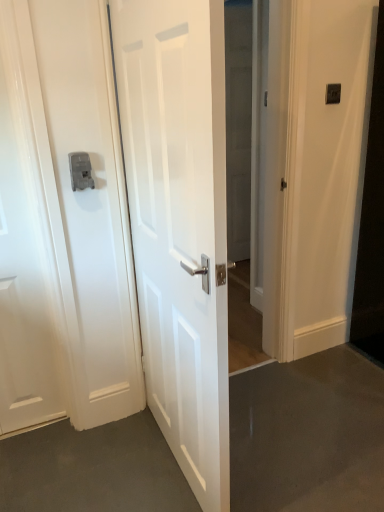
Question: From a real-world perspective, is satin silver latch at left under white glossy door at left, arranged as the 2th door when viewed from the right?

Choices:
 (A) no
 (B) yes

Answer: (A)

Question: Is satin silver latch at left positioned beyond the bounds of white glossy door at left, arranged as the 2th door when viewed from the right?

Choices:
 (A) no
 (B) yes

Answer: (B)

Question: Does satin silver latch at left come in front of white glossy door at left, arranged as the 2th door when viewed from the right?

Choices:
 (A) no
 (B) yes

Answer: (A)

Question: Considering the relative sizes of satin silver latch at left and white glossy door at left, which is the 1th door in left-to-right order, in the image provided, is satin silver latch at left thinner than white glossy door at left, which is the 1th door in left-to-right order,?

Choices:
 (A) yes
 (B) no

Answer: (B)

Question: Is there a large distance between satin silver latch at left and white glossy door at left, which is the 1th door in left-to-right order?

Choices:
 (A) yes
 (B) no

Answer: (B)

Question: Can you confirm if satin silver latch at left is positioned to the left of white glossy door at left, arranged as the 2th door when viewed from the right?

Choices:
 (A) yes
 (B) no

Answer: (B)

Question: Does black plastic light switch at upper right have a larger size compared to white glossy door at left, which is the 1th door in left-to-right order?

Choices:
 (A) no
 (B) yes

Answer: (A)

Question: Is black plastic light switch at upper right not inside white glossy door at left, which is the 1th door in left-to-right order?

Choices:
 (A) yes
 (B) no

Answer: (A)

Question: From the image's perspective, is black plastic light switch at upper right over white glossy door at left, which is the 1th door in left-to-right order?

Choices:
 (A) no
 (B) yes

Answer: (B)

Question: Can white glossy door at left, arranged as the 2th door when viewed from the right, be found inside black plastic light switch at upper right?

Choices:
 (A) no
 (B) yes

Answer: (A)

Question: From a real-world perspective, does black plastic light switch at upper right sit lower than white glossy door at left, arranged as the 2th door when viewed from the right?

Choices:
 (A) no
 (B) yes

Answer: (A)

Question: Is black plastic light switch at upper right thinner than white glossy door at left, which is the 1th door in left-to-right order?

Choices:
 (A) no
 (B) yes

Answer: (B)

Question: From a real-world perspective, is white glossy door at center, the 2th door when ordered from left to right, physically above transparent glass door at center?

Choices:
 (A) no
 (B) yes

Answer: (A)